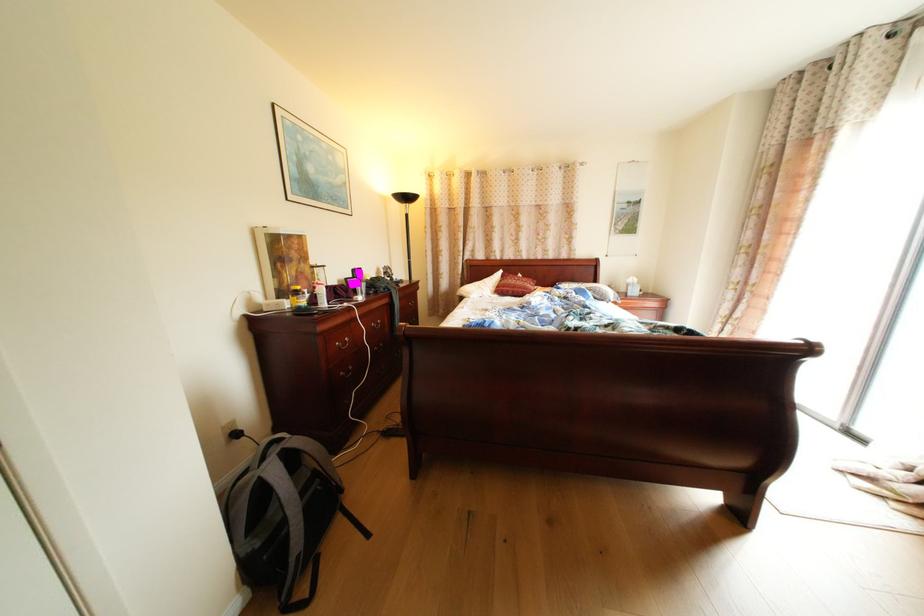
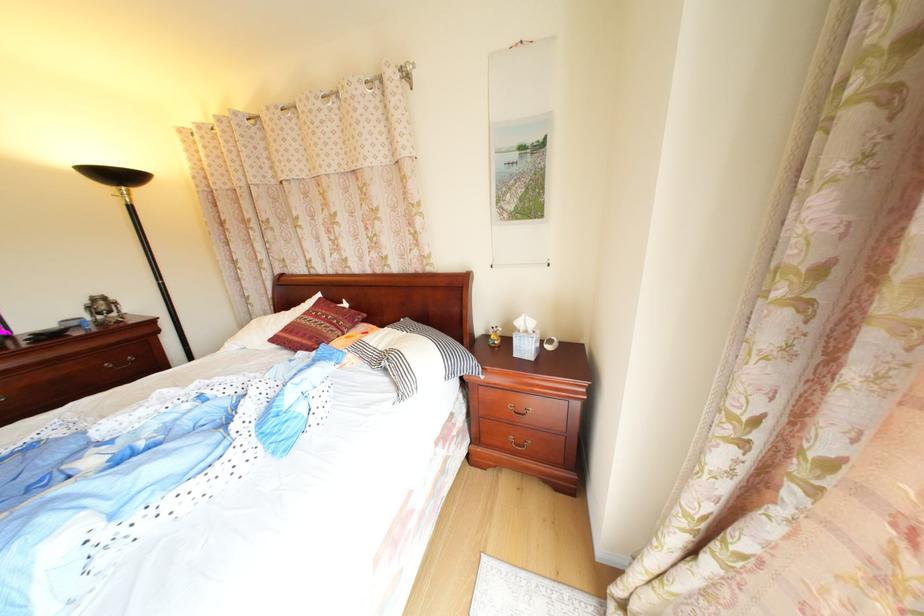
The images are taken continuously from a first-person perspective. In which direction are you moving?

The movement direction of the cameraman is right, forward.